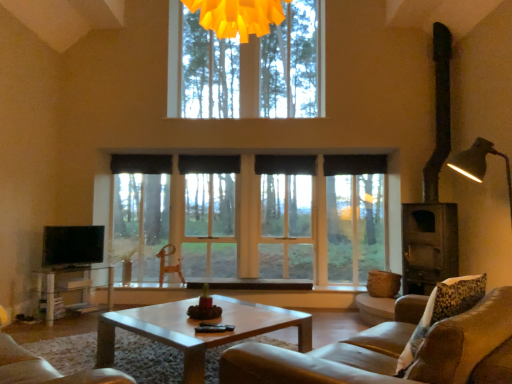
Question: From a real-world perspective, is light brown wooden coffee table at center above or below fluffy beige pillow at right?

Choices:
 (A) above
 (B) below

Answer: (B)

Question: Relative to fluffy beige pillow at right, is light brown wooden coffee table at center in front or behind?

Choices:
 (A) front
 (B) behind

Answer: (B)

Question: Estimate the real-world distances between objects in this image. Which object is closer to the black fabric curtain at center, arranged as the 3th curtain when viewed from the right?

Choices:
 (A) wooden armchair at center
 (B) dark brown wood stove at right
 (C) fluffy beige pillow at right
 (D) black fabric curtain at center, the second curtain viewed from the right
 (E) brown leather couch at center

Answer: (D)

Question: Which object is positioned closest to the dark brown wood stove at right?

Choices:
 (A) light brown wooden coffee table at center
 (B) clear glass entertainment center at lower left
 (C) black fabric curtain at center, arranged as the first curtain when viewed from the left
 (D) brown leather couch at center
 (E) flat screen tv at left

Answer: (A)